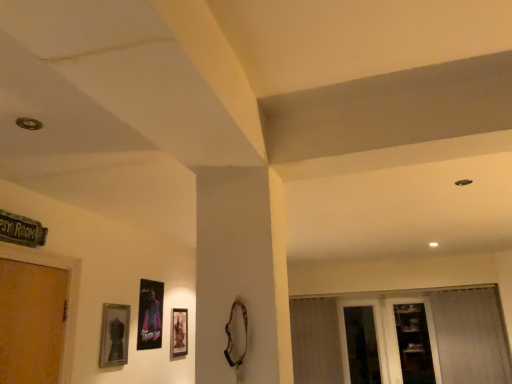
Question: Is wooden shelf at lower right bigger than transparent glass door at lower right?

Choices:
 (A) no
 (B) yes

Answer: (B)

Question: Does wooden shelf at lower right contain transparent glass door at lower right?

Choices:
 (A) yes
 (B) no

Answer: (A)

Question: Considering the relative sizes of wooden shelf at lower right and transparent glass door at lower right in the image provided, is wooden shelf at lower right smaller than transparent glass door at lower right?

Choices:
 (A) no
 (B) yes

Answer: (A)

Question: Does wooden shelf at lower right appear on the right side of transparent glass door at lower right?

Choices:
 (A) yes
 (B) no

Answer: (A)

Question: From a real-world perspective, does wooden shelf at lower right stand above transparent glass door at lower right?

Choices:
 (A) yes
 (B) no

Answer: (A)

Question: Considering the positions of matte silver picture frame at lower left, placed as the third picture frame when sorted from back to front, and matte black picture frame at lower center, the third picture frame positioned from the left, in the image, is matte silver picture frame at lower left, placed as the third picture frame when sorted from back to front, bigger or smaller than matte black picture frame at lower center, the third picture frame positioned from the left,?

Choices:
 (A) big
 (B) small

Answer: (A)

Question: From the image's perspective, is matte silver picture frame at lower left, placed as the third picture frame when sorted from back to front, above or below matte black picture frame at lower center, which appears as the first picture frame when viewed from the right?

Choices:
 (A) above
 (B) below

Answer: (A)

Question: Would you say matte silver picture frame at lower left, acting as the first picture frame starting from the left, is to the left or to the right of matte black picture frame at lower center, which appears as the first picture frame when viewed from the right, in the picture?

Choices:
 (A) left
 (B) right

Answer: (A)

Question: In terms of height, does matte silver picture frame at lower left, the 1th picture frame when ordered from front to back, look taller or shorter compared to matte black picture frame at lower center, which appears as the first picture frame when viewed from the right?

Choices:
 (A) tall
 (B) short

Answer: (B)

Question: In the image, is wooden shelf at lower right on the left side or the right side of matte silver picture frame at lower left, the 3th picture frame positioned from the right?

Choices:
 (A) right
 (B) left

Answer: (A)

Question: From the image's perspective, relative to matte silver picture frame at lower left, acting as the first picture frame starting from the left, is wooden shelf at lower right above or below?

Choices:
 (A) below
 (B) above

Answer: (A)

Question: Would you say wooden shelf at lower right is inside or outside matte silver picture frame at lower left, placed as the third picture frame when sorted from back to front?

Choices:
 (A) inside
 (B) outside

Answer: (B)

Question: Considering the positions of wooden shelf at lower right and matte silver picture frame at lower left, acting as the first picture frame starting from the left, in the image, is wooden shelf at lower right wider or thinner than matte silver picture frame at lower left, acting as the first picture frame starting from the left,?

Choices:
 (A) wide
 (B) thin

Answer: (A)

Question: Considering their positions, is metallic poster at center, the second picture frame when ordered from back to front, located in front of or behind wooden shelf at lower right?

Choices:
 (A) behind
 (B) front

Answer: (B)

Question: Is metallic poster at center, which appears as the second picture frame when viewed from the front, spatially inside wooden shelf at lower right, or outside of it?

Choices:
 (A) outside
 (B) inside

Answer: (A)